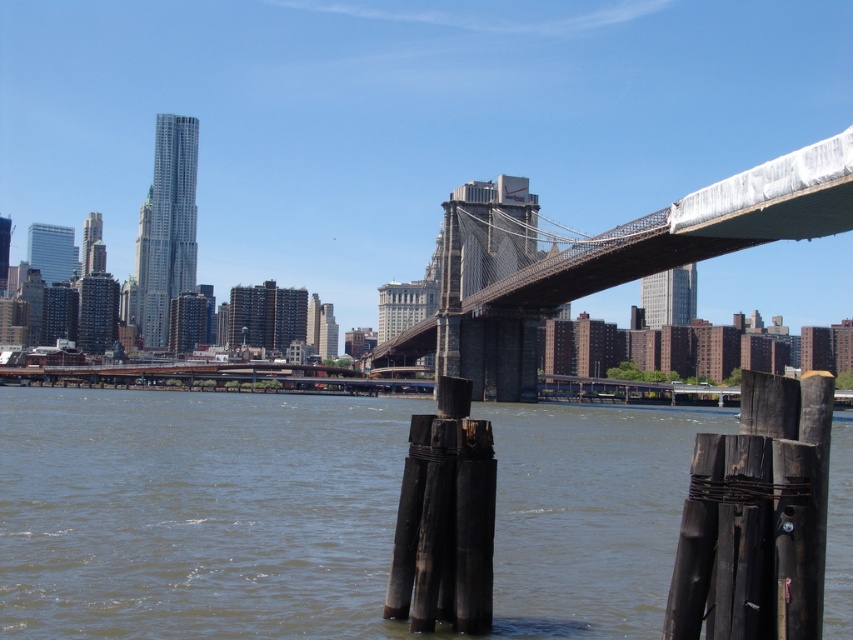
You are standing at the camera position and want to place a 50 meter long boat between the brown wooden posts at lower center and your current position. Is there enough space to fit the boat?

The distance between the brown wooden posts at lower center and the camera is 48.93 meters, so the 50 meter long boat would not fit as it is longer than the available space.

You are a delivery drone with a wingspan of 1.5 meters. You need to fly from the brown wooden posts at lower center to the metallic gray bridge at center. Is there enough space between them for your drone to pass safely?

The brown wooden posts at lower center and metallic gray bridge at center are 42.18 meters apart, which is more than enough space for a drone with a 1.5 meter wingspan to pass safely between them.

You are standing at the base of the Brooklyn Bridge and notice the brown wooden posts at lower center. According to the coordinates provided, where exactly are these posts positioned relative to the bridge?

The brown wooden posts at lower center are located at point coordinates of 0.802 on the x axis and 0.232 on the y axis.